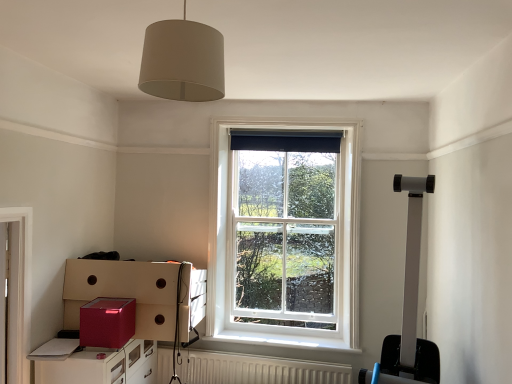
What do you see at coordinates (257, 369) in the screenshot? I see `white textured radiator at lower center` at bounding box center [257, 369].

What do you see at coordinates (183, 61) in the screenshot? I see `matte white lampshade at upper center` at bounding box center [183, 61].

The width and height of the screenshot is (512, 384). What do you see at coordinates (284, 236) in the screenshot?
I see `white wooden window at center` at bounding box center [284, 236].

I want to click on black fabric curtain at upper center, so click(x=286, y=144).

Describe the element at coordinates (286, 144) in the screenshot. The height and width of the screenshot is (384, 512). I see `black fabric curtain at upper center` at that location.

How much space does shiny red cardboard box at lower left, marked as the second cardboard box in a back-to-front arrangement, occupy horizontally?

shiny red cardboard box at lower left, marked as the second cardboard box in a back-to-front arrangement, is 9.62 inches wide.

Identify the location of matte red cardboard box at lower left, the first cardboard box when ordered from back to front. The height and width of the screenshot is (384, 512). (125, 292).

Based on the photo, from the image's perspective, between white textured radiator at lower center and white wooden window at center, who is located below?

white textured radiator at lower center is shown below in the image.

Which object is wider, white textured radiator at lower center or white wooden window at center?

white textured radiator at lower center is wider.

In the scene shown: From a real-world perspective, does white textured radiator at lower center sit lower than white wooden window at center?

Yes, from a real-world perspective, white textured radiator at lower center is beneath white wooden window at center.

Considering the relative sizes of white textured radiator at lower center and white wooden window at center in the image provided, is white textured radiator at lower center bigger than white wooden window at center?

No.

Which of these two, matte white lampshade at upper center or white textured radiator at lower center, is smaller?

matte white lampshade at upper center.

Is matte white lampshade at upper center next to white textured radiator at lower center?

There is a gap between matte white lampshade at upper center and white textured radiator at lower center.

Between matte white lampshade at upper center and white textured radiator at lower center, which one has more height?

With more height is matte white lampshade at upper center.

Between matte white lampshade at upper center and white textured radiator at lower center, which one has smaller width?

white textured radiator at lower center.

Would you say matte red cardboard box at lower left, the first cardboard box when ordered from back to front, contains white wooden window at center?

No.

Is matte red cardboard box at lower left, the first cardboard box when ordered from back to front, in contact with white wooden window at center?

There is a gap between matte red cardboard box at lower left, the first cardboard box when ordered from back to front, and white wooden window at center.

Which is farther from the camera, (285, 146) or (134, 366)?

The point (285, 146) is farther.

Does black fabric curtain at upper center lie behind shiny red cabinet at lower left?

Yes, it is.

Is black fabric curtain at upper center next to shiny red cabinet at lower left and touching it?

black fabric curtain at upper center and shiny red cabinet at lower left are not in contact.

In terms of width, does black fabric curtain at upper center look wider or thinner when compared to shiny red cabinet at lower left?

black fabric curtain at upper center is thinner than shiny red cabinet at lower left.

Between point (271, 357) and point (91, 302), which one is positioned in front?

Positioned in front is point (91, 302).

How many degrees apart are the facing directions of white textured radiator at lower center and shiny red cardboard box at lower left, marked as the second cardboard box in a back-to-front arrangement?

They differ by 0.859 degrees in their facing directions.

Considering the positions of objects white textured radiator at lower center and shiny red cardboard box at lower left, positioned as the first cardboard box in front-to-back order, in the image provided, who is in front, white textured radiator at lower center or shiny red cardboard box at lower left, positioned as the first cardboard box in front-to-back order,?

shiny red cardboard box at lower left, positioned as the first cardboard box in front-to-back order.

Can you confirm if white textured radiator at lower center is taller than shiny red cardboard box at lower left, marked as the second cardboard box in a back-to-front arrangement?

Yes, white textured radiator at lower center is taller than shiny red cardboard box at lower left, marked as the second cardboard box in a back-to-front arrangement.

Can matte red cardboard box at lower left, which is the 2th cardboard box from front to back, be found inside shiny red cabinet at lower left?

Definitely not — matte red cardboard box at lower left, which is the 2th cardboard box from front to back, is not inside shiny red cabinet at lower left.

At what (x,y) coordinates should I click in order to perform the action: click on cabinetry below the matte red cardboard box at lower left, which is the 2th cardboard box from front to back (from the image's perspective). Please return your answer as a coordinate pair (x, y). The image size is (512, 384). Looking at the image, I should click on (103, 366).

From the image's perspective, is shiny red cabinet at lower left on top of matte red cardboard box at lower left, the first cardboard box when ordered from back to front?

No, from the image's perspective, shiny red cabinet at lower left is not on top of matte red cardboard box at lower left, the first cardboard box when ordered from back to front.

What's the angular difference between shiny red cardboard box at lower left, positioned as the first cardboard box in front-to-back order, and matte red cardboard box at lower left, which is the 2th cardboard box from front to back,'s facing directions?

0.0907 degrees.

Is matte red cardboard box at lower left, the first cardboard box when ordered from back to front, completely or partially inside shiny red cardboard box at lower left, marked as the second cardboard box in a back-to-front arrangement?

Actually, matte red cardboard box at lower left, the first cardboard box when ordered from back to front, is outside shiny red cardboard box at lower left, marked as the second cardboard box in a back-to-front arrangement.

Which is less distant, (90,314) or (205,278)?

Point (90,314).

Identify the location of radiator lying in front of the white wooden window at center. This screenshot has height=384, width=512. [x=257, y=369].

Find the location of a particular element. This screenshot has height=384, width=512. light fixture above the white textured radiator at lower center (from a real-world perspective) is located at coordinates (183, 61).

Based on their spatial positions, is shiny red cabinet at lower left or black fabric curtain at upper center closer to shiny red cardboard box at lower left, marked as the second cardboard box in a back-to-front arrangement?

The object closer to shiny red cardboard box at lower left, marked as the second cardboard box in a back-to-front arrangement, is shiny red cabinet at lower left.

Based on their spatial positions, is matte white lampshade at upper center or matte red cardboard box at lower left, the first cardboard box when ordered from back to front, further from black fabric curtain at upper center?

matte white lampshade at upper center.

Considering their positions, is matte red cardboard box at lower left, which is the 2th cardboard box from front to back, positioned further to shiny red cardboard box at lower left, marked as the second cardboard box in a back-to-front arrangement, than matte white lampshade at upper center?

matte white lampshade at upper center is further to shiny red cardboard box at lower left, marked as the second cardboard box in a back-to-front arrangement.

From the image, which object appears to be nearer to shiny red cabinet at lower left, shiny red cardboard box at lower left, marked as the second cardboard box in a back-to-front arrangement, or black fabric curtain at upper center?

shiny red cardboard box at lower left, marked as the second cardboard box in a back-to-front arrangement, is positioned closer to the anchor shiny red cabinet at lower left.

From the image, which object appears to be farther from white wooden window at center, shiny red cardboard box at lower left, marked as the second cardboard box in a back-to-front arrangement, or matte white lampshade at upper center?

matte white lampshade at upper center lies further to white wooden window at center than the other object.

Looking at the image, which one is located closer to shiny red cabinet at lower left, matte white lampshade at upper center or black fabric curtain at upper center?

black fabric curtain at upper center lies closer to shiny red cabinet at lower left than the other object.

Based on the photo, from the image, which object appears to be farther from black fabric curtain at upper center, white wooden window at center or matte white lampshade at upper center?

Among the two, matte white lampshade at upper center is located further to black fabric curtain at upper center.

Considering their positions, is shiny red cardboard box at lower left, positioned as the first cardboard box in front-to-back order, positioned closer to matte red cardboard box at lower left, which is the 2th cardboard box from front to back, than white wooden window at center?

Among the two, shiny red cardboard box at lower left, positioned as the first cardboard box in front-to-back order, is located nearer to matte red cardboard box at lower left, which is the 2th cardboard box from front to back.

Where is `cabinetry between matte white lampshade at upper center and white textured radiator at lower center in the up-down direction`? This screenshot has width=512, height=384. cabinetry between matte white lampshade at upper center and white textured radiator at lower center in the up-down direction is located at coordinates (103, 366).

Identify the location of cardboard box between shiny red cardboard box at lower left, marked as the second cardboard box in a back-to-front arrangement, and white textured radiator at lower center. (125, 292).

Locate an element on the screen. Image resolution: width=512 pixels, height=384 pixels. window situated between shiny red cardboard box at lower left, positioned as the first cardboard box in front-to-back order, and black fabric curtain at upper center from left to right is located at coordinates click(x=284, y=236).

Locate an element on the screen. This screenshot has height=384, width=512. radiator between shiny red cabinet at lower left and white wooden window at center in the horizontal direction is located at coordinates (257, 369).